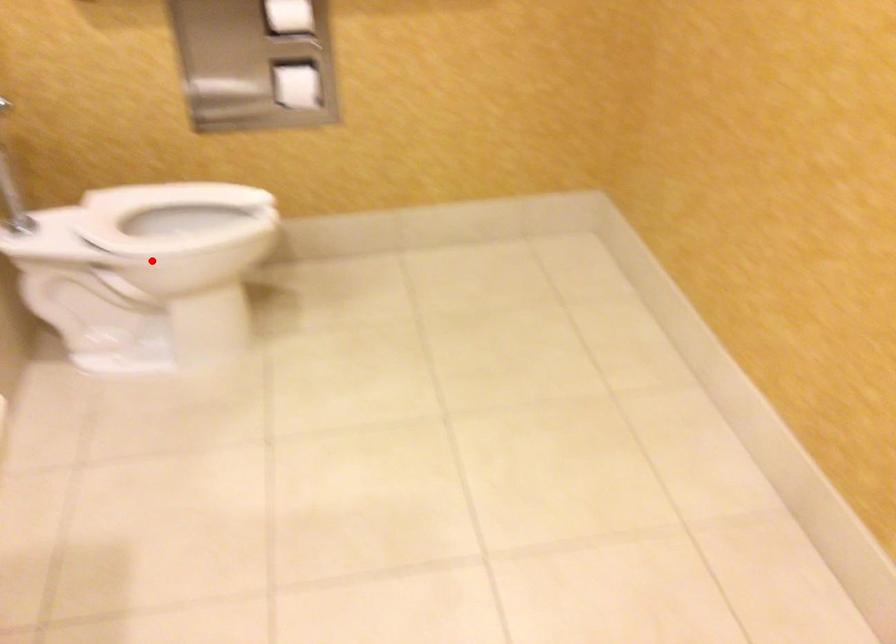
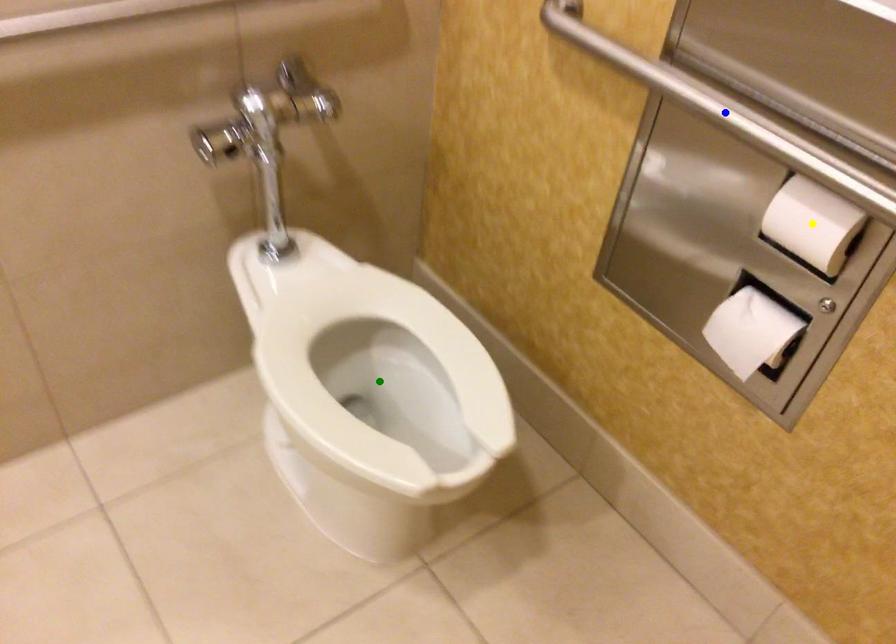
Question: I am providing you with two images of the same scene from different viewpoints. A red point is marked on the first image. You are given multiple points on the second image. Which spot in image 2 lines up with the point in image 1?

Choices:
 (A) yellow point
 (B) blue point
 (C) green point

Answer: (C)